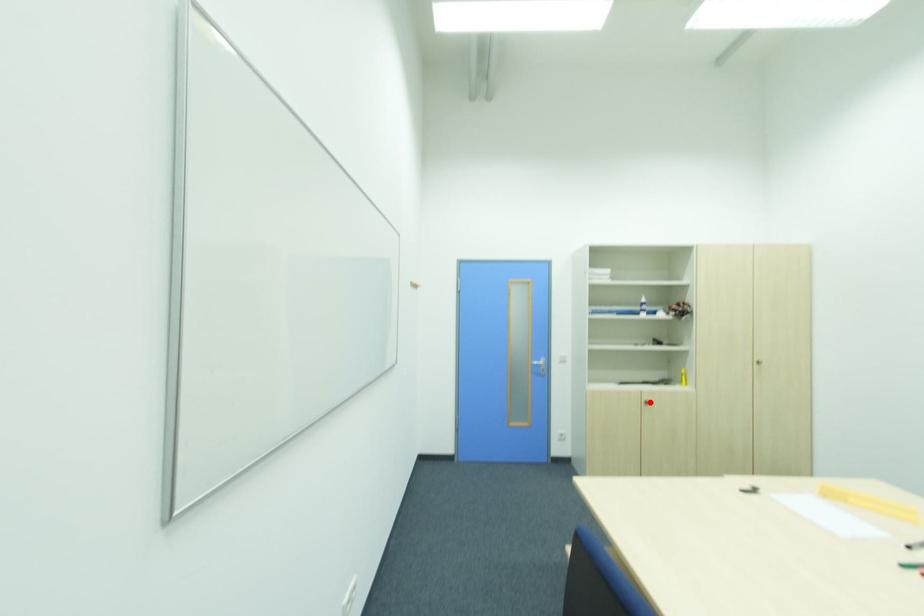
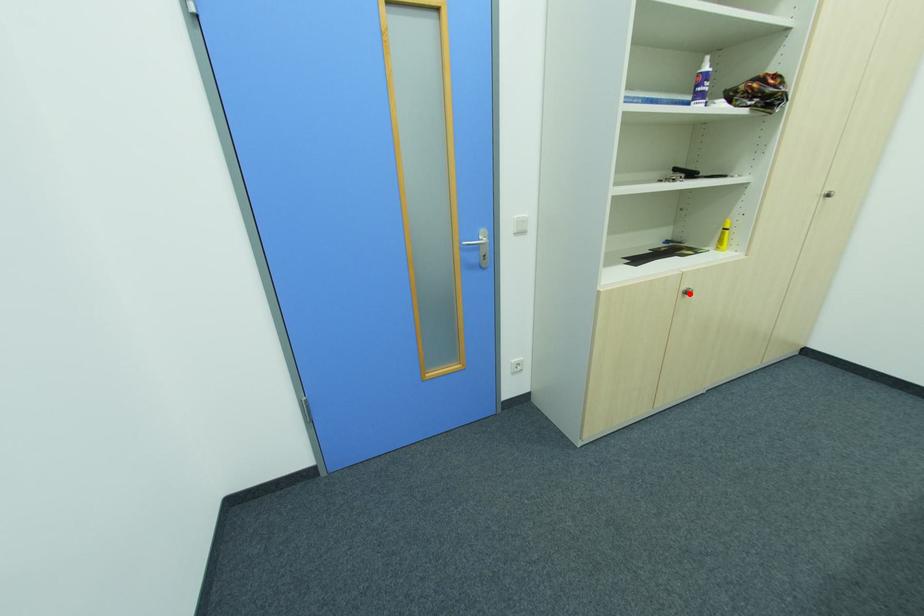
I am providing you with two images of the same scene from different viewpoints. A red point is marked on the first image and another point is marked on the second image. Is the red point in image1 aligned with the point shown in image2?

Yes